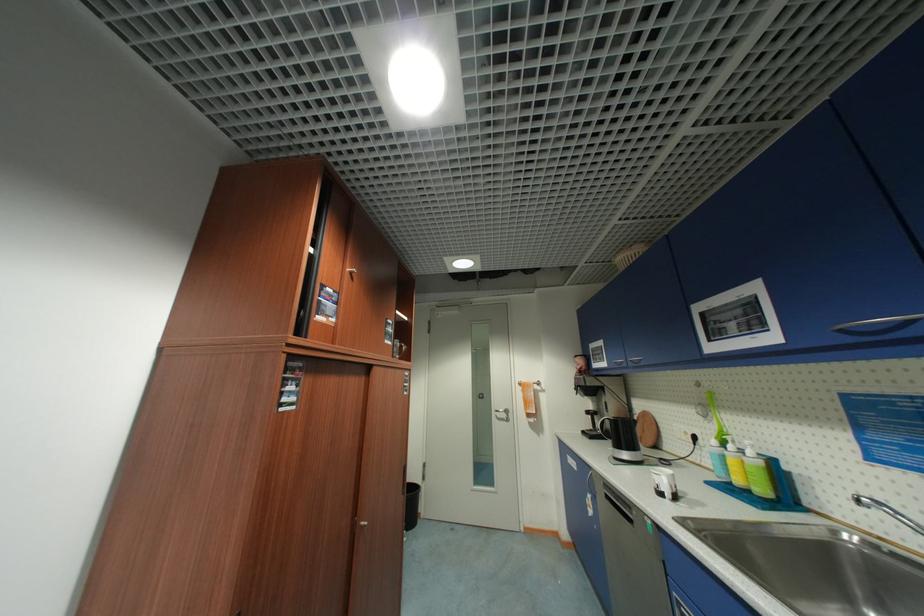
This screenshot has height=616, width=924. I want to click on silver door handle, so click(502, 411).